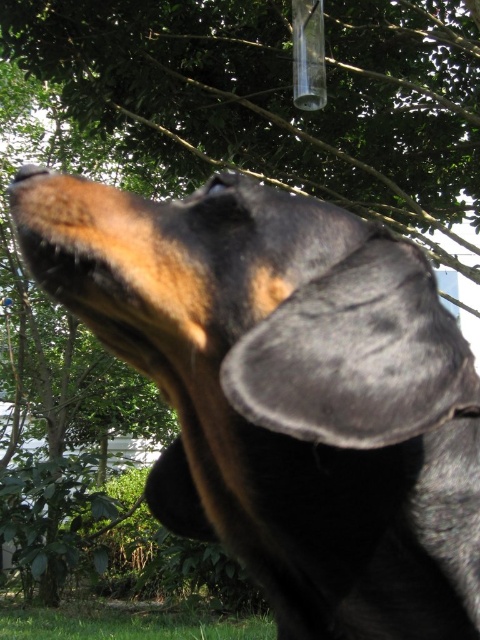
Is point (430, 532) positioned behind point (275, 637)?

No, (430, 532) is in front of (275, 637).

Can you confirm if black fur dog at center is positioned to the left of green grass at lower center?

Incorrect, black fur dog at center is not on the left side of green grass at lower center.

Does point (458, 461) come closer to viewer compared to point (168, 612)?

That is True.

Image resolution: width=480 pixels, height=640 pixels. I want to click on black fur dog at center, so click(x=286, y=392).